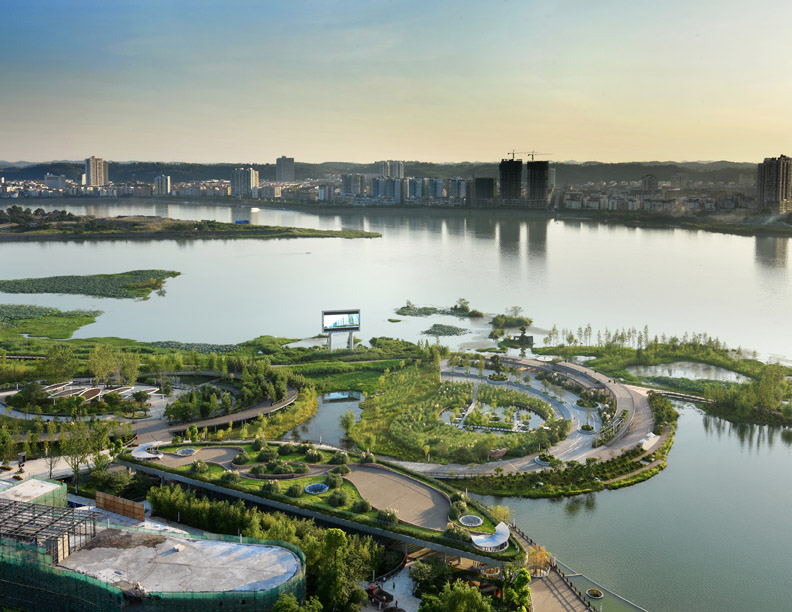
Where is `screen`? The width and height of the screenshot is (792, 612). screen is located at coordinates click(x=341, y=316).